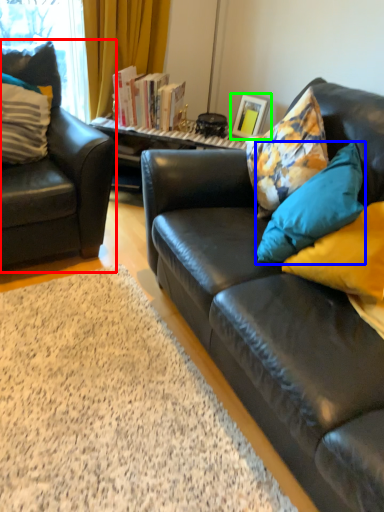
Question: Which object is the farthest from chair (highlighted by a red box)? Choose among these: pillow (highlighted by a blue box) or picture frame (highlighted by a green box).

Choices:
 (A) pillow
 (B) picture frame

Answer: (A)